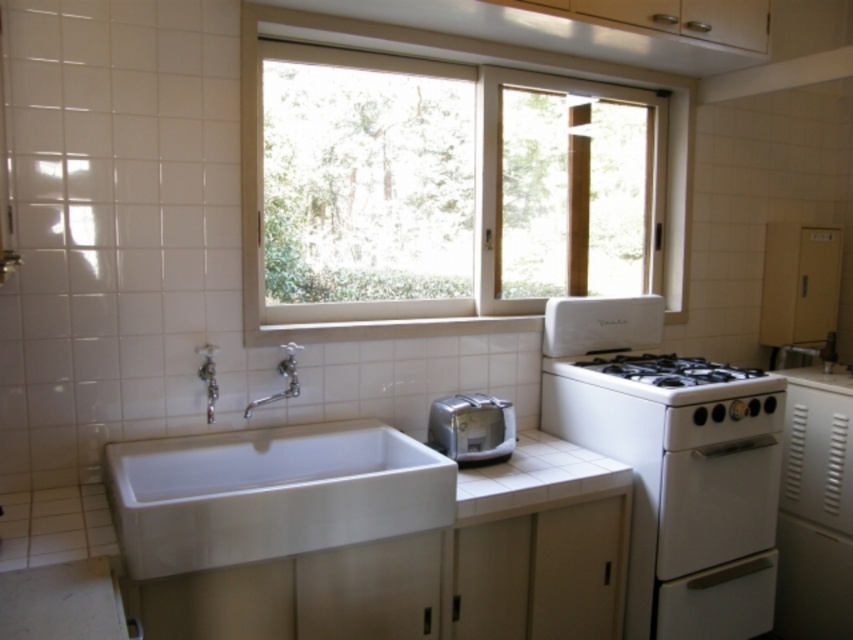
Question: From the image, what is the correct spatial relationship of white plastic window at upper center in relation to brushed metal faucet at left?

Choices:
 (A) left
 (B) right

Answer: (B)

Question: Can you confirm if white glossy stove at right is wider than brushed metal faucet at left?

Choices:
 (A) yes
 (B) no

Answer: (A)

Question: Which of the following is the farthest from the observer?

Choices:
 (A) white plastic window at upper center
 (B) white glossy stove at right
 (C) silver metallic faucet at sink left

Answer: (B)

Question: Which object appears closest to the camera in this image?

Choices:
 (A) white glossy stove at right
 (B) white ceramic sink at lower left

Answer: (B)

Question: Considering the relative positions of white tile counter top at center and brushed metal faucet at left in the image provided, where is white tile counter top at center located with respect to brushed metal faucet at left?

Choices:
 (A) below
 (B) above

Answer: (A)

Question: Among these objects, which one is nearest to the camera?

Choices:
 (A) satin silver toaster at lower center
 (B) white ceramic sink at lower left
 (C) white plastic window at upper center
 (D) white glossy stove at right

Answer: (B)